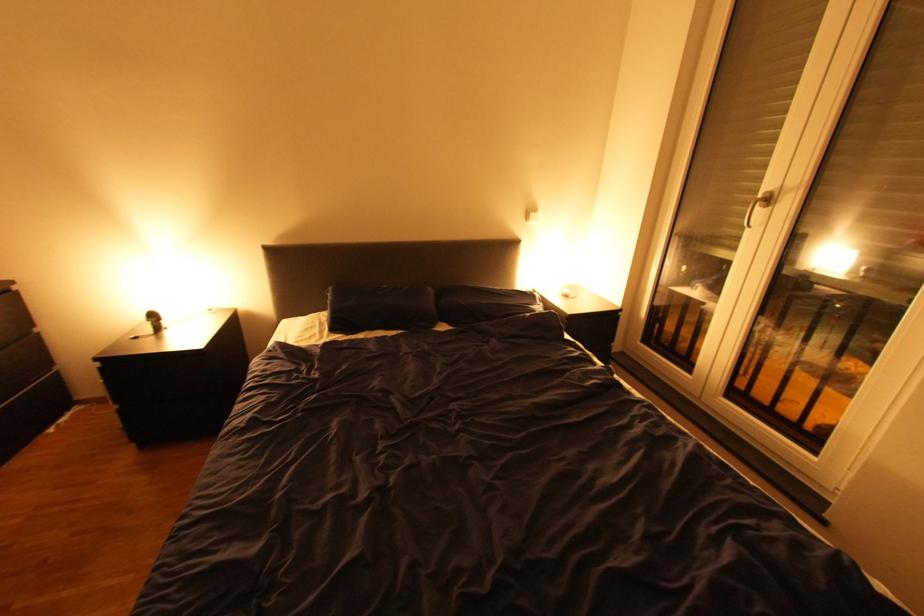
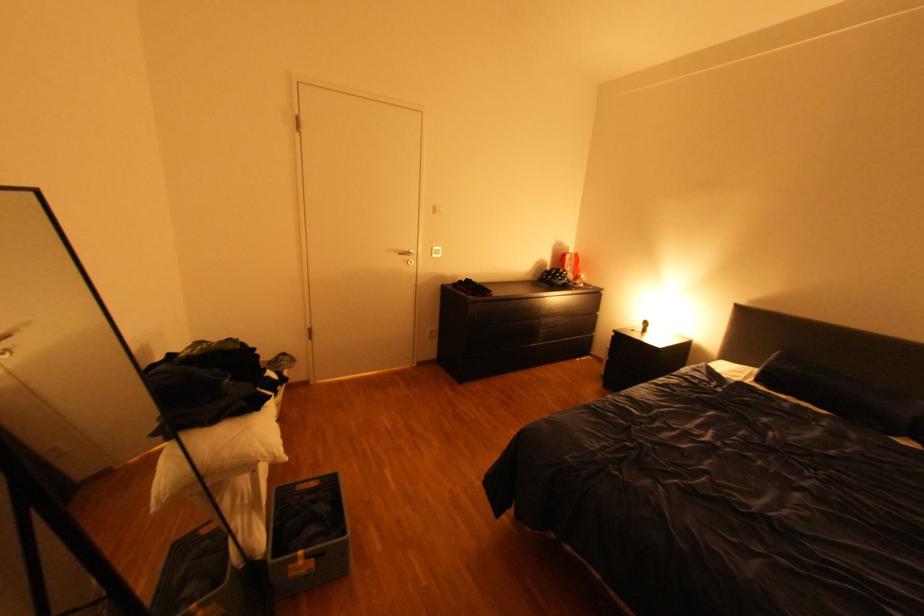
Where in the second image is the point corresponding to pixel 172 322 from the first image?

(659, 328)